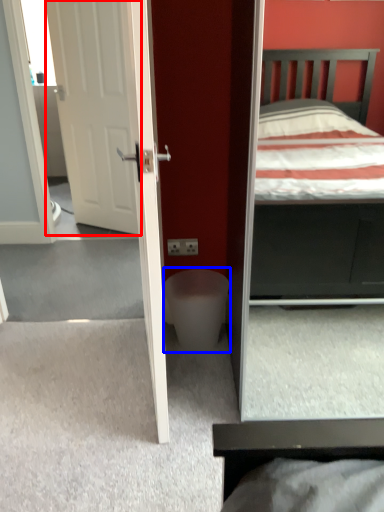
Question: Among these objects, which one is farthest to the camera, door (highlighted by a red box) or toilet bowl (highlighted by a blue box)?

Choices:
 (A) door
 (B) toilet bowl

Answer: (A)